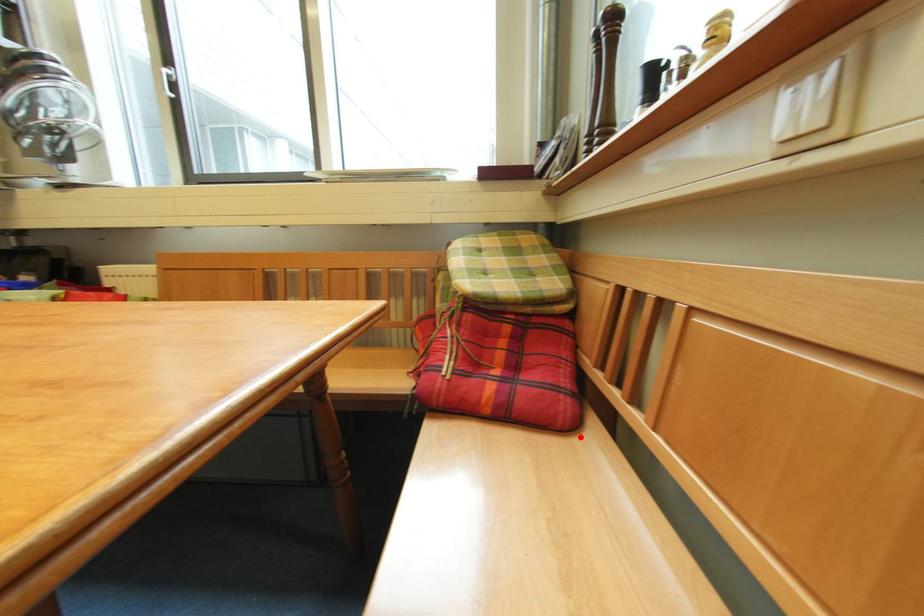
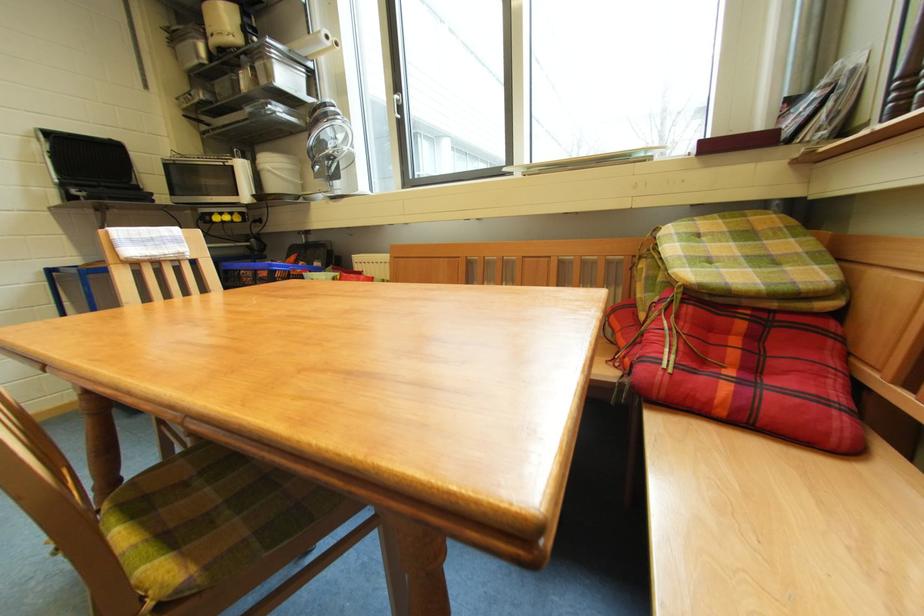
Question: I am providing you with two images of the same scene from different viewpoints. In image1, a red point is highlighted. Considering the same 3D point in image2, which of the following is correct?

Choices:
 (A) It is closer
 (B) It is farther

Answer: (B)